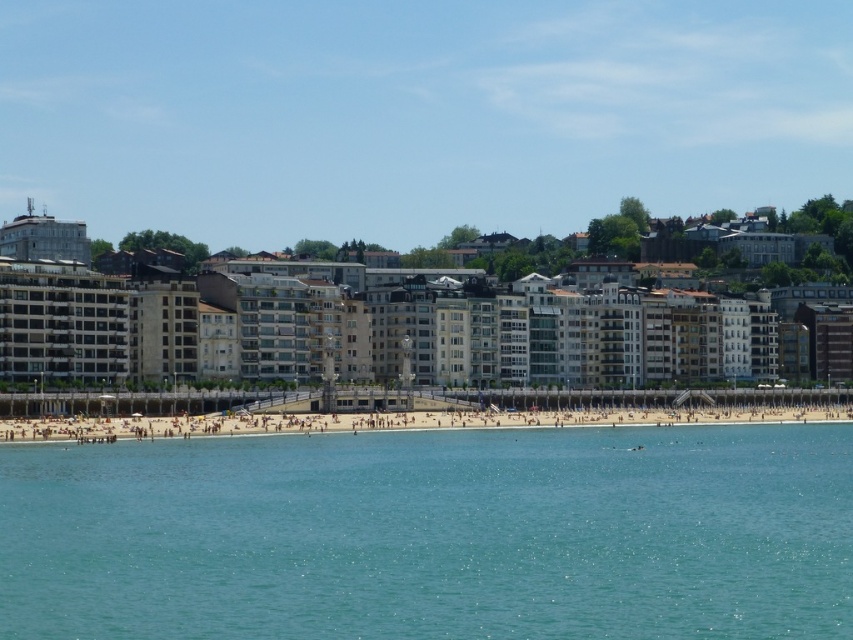
Is beige stone building at center positioned at the back of light brown sand at center?

Yes.

Can you confirm if beige stone building at center is positioned above light brown sand at center?

Yes.

Does point (502, 333) come farther from viewer compared to point (628, 424)?

That is True.

Where is `beige stone building at center`? beige stone building at center is located at coordinates (567, 332).

Who is more forward, [827,560] or [752,416]?

Point [827,560] is more forward.

Who is taller, clear blue water at beach center or light brown sand at center?

With more height is light brown sand at center.

The width and height of the screenshot is (853, 640). Identify the location of clear blue water at beach center. (433, 536).

Find the location of a particular element. This screenshot has height=640, width=853. clear blue water at beach center is located at coordinates (433, 536).

Measure the distance between clear blue water at beach center and beige stone building at center.

The distance of clear blue water at beach center from beige stone building at center is 107.26 feet.

Does clear blue water at beach center lie behind beige stone building at center?

That is False.

This screenshot has height=640, width=853. Describe the element at coordinates (433, 536) in the screenshot. I see `clear blue water at beach center` at that location.

Where is `clear blue water at beach center`? The width and height of the screenshot is (853, 640). clear blue water at beach center is located at coordinates (433, 536).